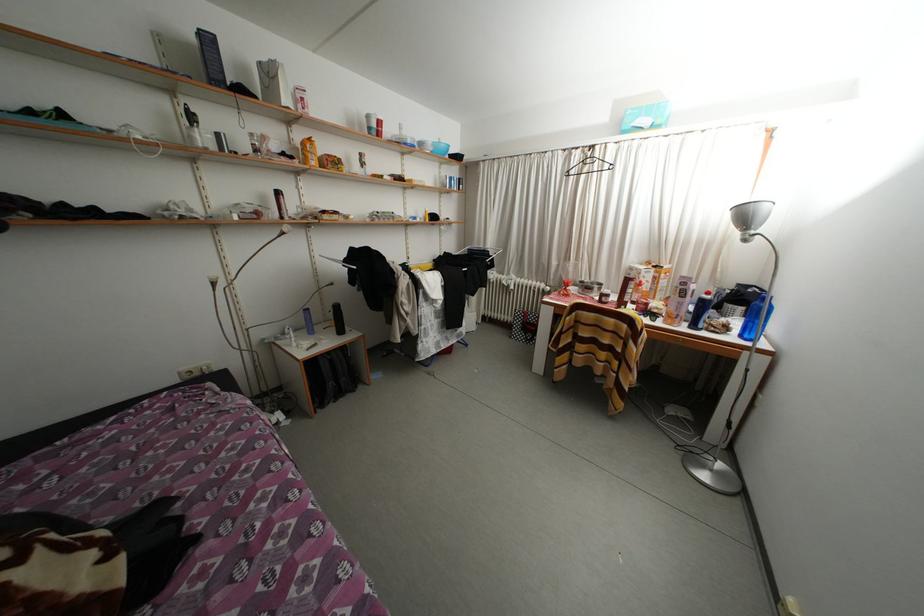
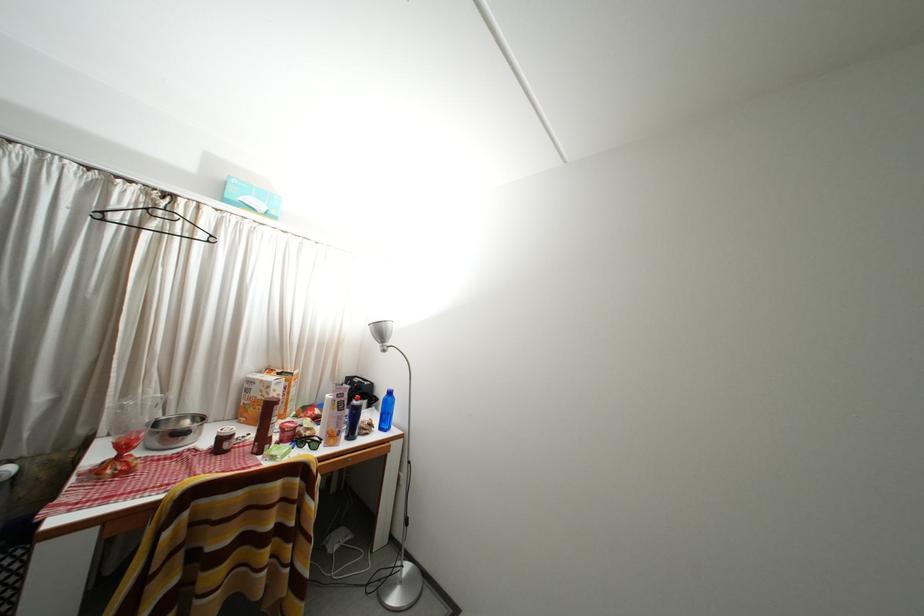
Find the pixel in the second image that matches pixel 655 127 in the first image.

(268, 211)